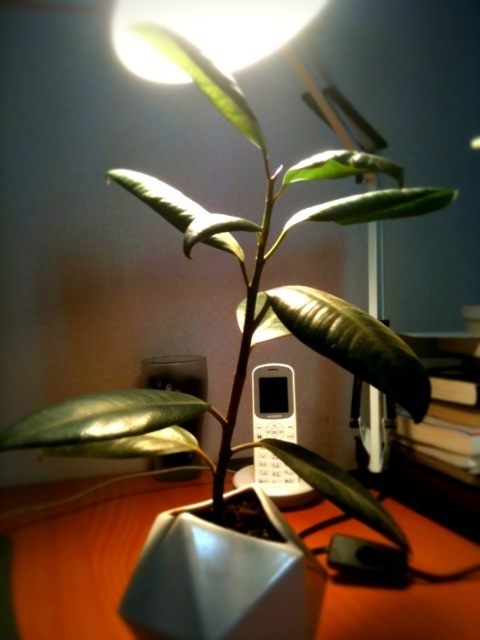
Question: Can you confirm if wooden table at center is wider than white plastic phone at center?

Choices:
 (A) yes
 (B) no

Answer: (A)

Question: Does wooden table at center have a greater width compared to white plastic phone at center?

Choices:
 (A) no
 (B) yes

Answer: (B)

Question: Can you confirm if wooden table at center is thinner than white plastic phone at center?

Choices:
 (A) no
 (B) yes

Answer: (A)

Question: Which object appears farthest from the camera in this image?

Choices:
 (A) wooden table at center
 (B) white plastic phone at center

Answer: (B)